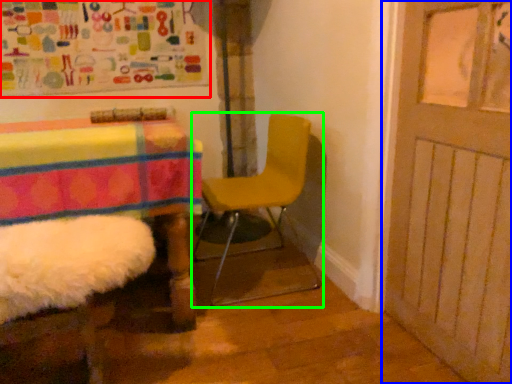
Question: Considering the real-world distances, which object is farthest from bulletin board (highlighted by a red box)? door (highlighted by a blue box) or chair (highlighted by a green box)?

Choices:
 (A) door
 (B) chair

Answer: (A)